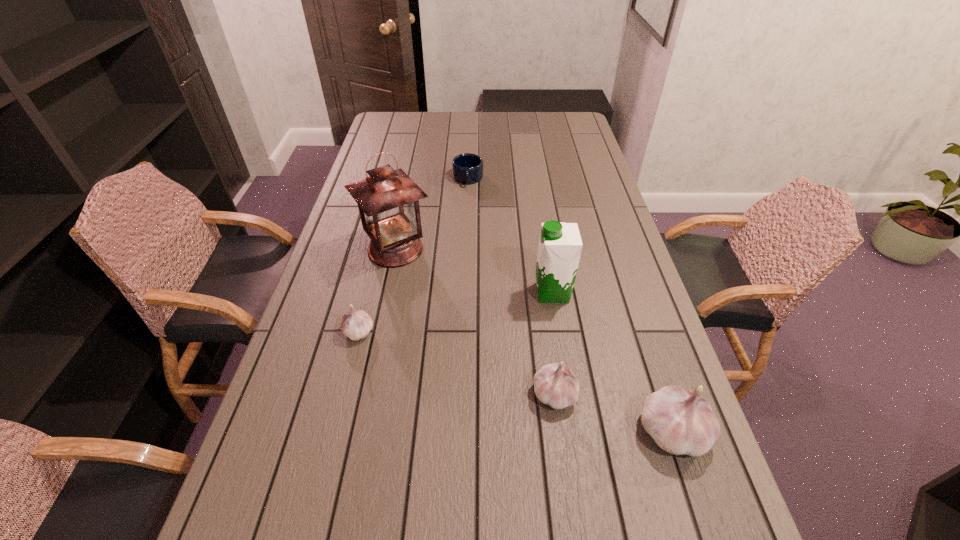
Find the location of a particular element. Image resolution: width=960 pixels, height=540 pixels. oil lamp is located at coordinates (388, 200).

Where is `the second farthest object`? the second farthest object is located at coordinates (388, 200).

The image size is (960, 540). I want to click on free location located 0.100m on the back of the farthest garlic, so click(x=369, y=292).

At what (x,y) coordinates should I click in order to perform the action: click on vacant region located on the left of the second garlic from right to left. Please return your answer as a coordinate pair (x, y). Looking at the image, I should click on (458, 394).

You are a GUI agent. You are given a task and a screenshot of the screen. Output one action in this format:
    pyautogui.click(x=<x>, y=<y>)
    Task: Click on the free space located 0.260m on the left of the third tallest object
    Image resolution: width=960 pixels, height=540 pixels.
    Given the screenshot: What is the action you would take?
    pyautogui.click(x=516, y=431)

Image resolution: width=960 pixels, height=540 pixels. What are the coordinates of `vacant space situated 0.070m with the handle on the side of the shortest object` in the screenshot? It's located at (467, 200).

The height and width of the screenshot is (540, 960). What are the coordinates of `free space located on the front-facing side of the fourth nearest object` in the screenshot? It's located at (412, 293).

Identify the location of vacant region located on the front-facing side of the fourth nearest object. (398, 293).

Find the location of a particular element. The height and width of the screenshot is (540, 960). vacant region located 0.090m on the front-facing side of the fourth nearest object is located at coordinates (501, 293).

You are a GUI agent. You are given a task and a screenshot of the screen. Output one action in this format:
    pyautogui.click(x=<x>, y=<y>)
    Task: Click on the vacant space located on the back of the tallest object
    Image resolution: width=960 pixels, height=540 pixels.
    Given the screenshot: What is the action you would take?
    pyautogui.click(x=408, y=189)